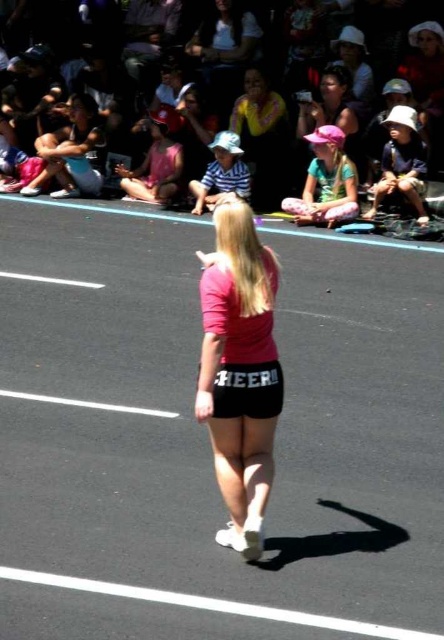
Question: Is pink matte shorts at center above matte pink shorts at center?

Choices:
 (A) yes
 (B) no

Answer: (B)

Question: Does yellow jersey at upper center appear over light blue denim shorts at lower left?

Choices:
 (A) no
 (B) yes

Answer: (B)

Question: Which point is farther to the camera?

Choices:
 (A) (348, 161)
 (B) (249, 81)
 (C) (248, 280)
 (D) (412, 125)

Answer: (B)

Question: Is yellow jersey at upper center above white cotton hat at upper right?

Choices:
 (A) yes
 (B) no

Answer: (A)

Question: Which point appears farthest from the camera in this image?

Choices:
 (A) (95, 124)
 (B) (341, 204)
 (C) (381, 160)

Answer: (A)

Question: Which of the following is the closest to the observer?

Choices:
 (A) matte pink shorts at center
 (B) pink matte shorts at center
 (C) pink fabric hat at center
 (D) light blue denim shorts at lower left

Answer: (B)